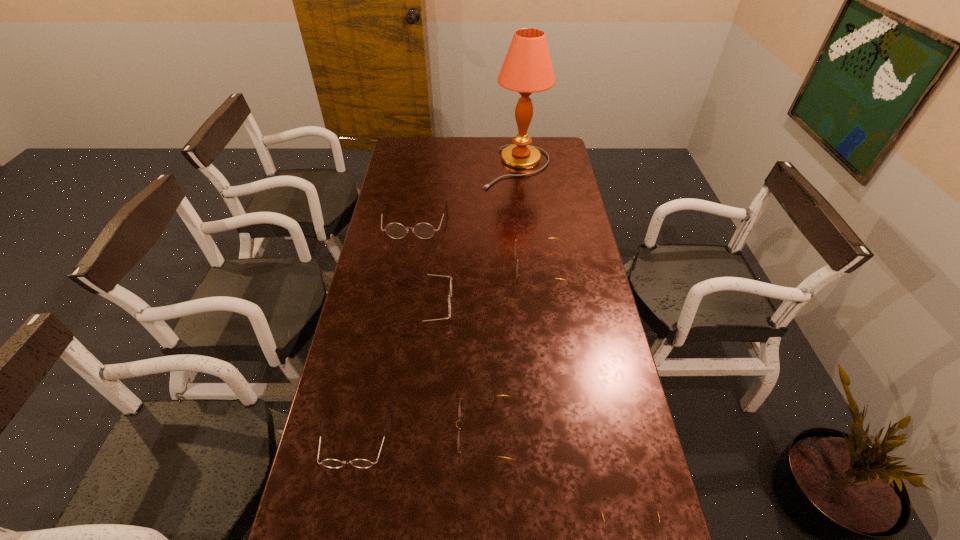
You are a GUI agent. You are given a task and a screenshot of the screen. Output one action in this format:
    pyautogui.click(x=<x>, y=<y>)
    Task: Click on the lamp that is at the right edge
    
    Given the screenshot: What is the action you would take?
    pyautogui.click(x=527, y=68)

Locate an element on the screen. spectacles positioned at the right edge is located at coordinates (515, 245).

The height and width of the screenshot is (540, 960). Identify the location of object located at the far right corner. 527,68.

You are a GUI agent. You are given a task and a screenshot of the screen. Output one action in this format:
    pyautogui.click(x=<x>, y=<y>)
    Task: Click on the vacant space at the left edge
    This screenshot has width=960, height=540.
    Given the screenshot: What is the action you would take?
    346,394

Find the location of a particular element. free space at the right edge of the desktop is located at coordinates (547, 247).

This screenshot has height=540, width=960. Identify the location of vacant space at the far left corner of the desktop. 411,159.

This screenshot has width=960, height=540. What are the coordinates of `vacant space at the far right corner` in the screenshot? It's located at (540, 158).

This screenshot has width=960, height=540. I want to click on unoccupied area between the leftmost gold spectacles and the smallest dark spectacles, so click(x=420, y=435).

The height and width of the screenshot is (540, 960). Identify the location of vacant area between the farthest dark spectacles and the second farthest dark spectacles. (419, 262).

Where is `vacant space in between the nearest dark spectacles and the third spectacles from right to left`? Image resolution: width=960 pixels, height=540 pixels. vacant space in between the nearest dark spectacles and the third spectacles from right to left is located at coordinates (420, 435).